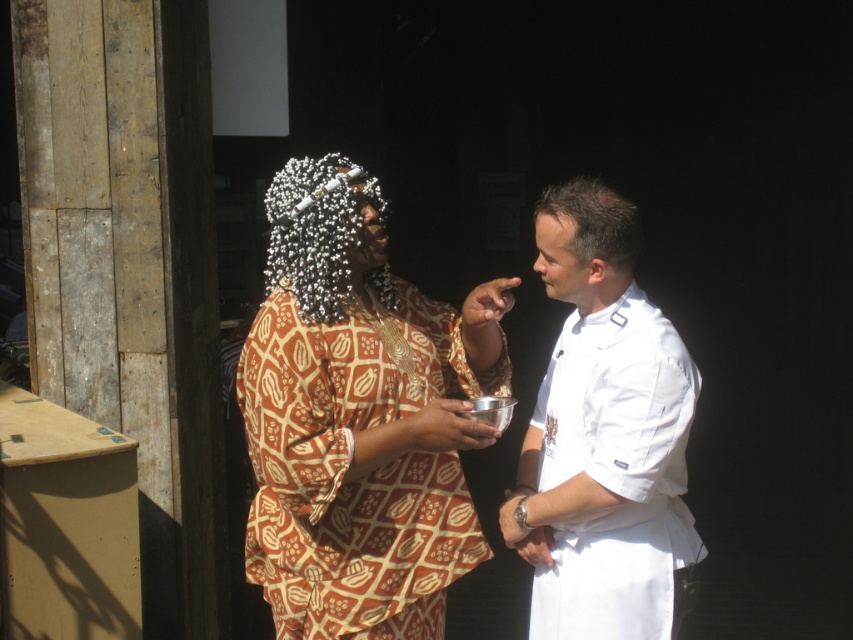
Question: Which point appears farthest from the camera in this image?

Choices:
 (A) coord(602,627)
 (B) coord(465,332)

Answer: (B)

Question: Can you confirm if brown printed fabric dress at center is positioned to the right of white smooth chef's uniform at right?

Choices:
 (A) no
 (B) yes

Answer: (A)

Question: Where is brown printed fabric dress at center located in relation to white smooth chef's uniform at right in the image?

Choices:
 (A) left
 (B) right

Answer: (A)

Question: Can you confirm if brown printed fabric dress at center is wider than white smooth chef's uniform at right?

Choices:
 (A) yes
 (B) no

Answer: (A)